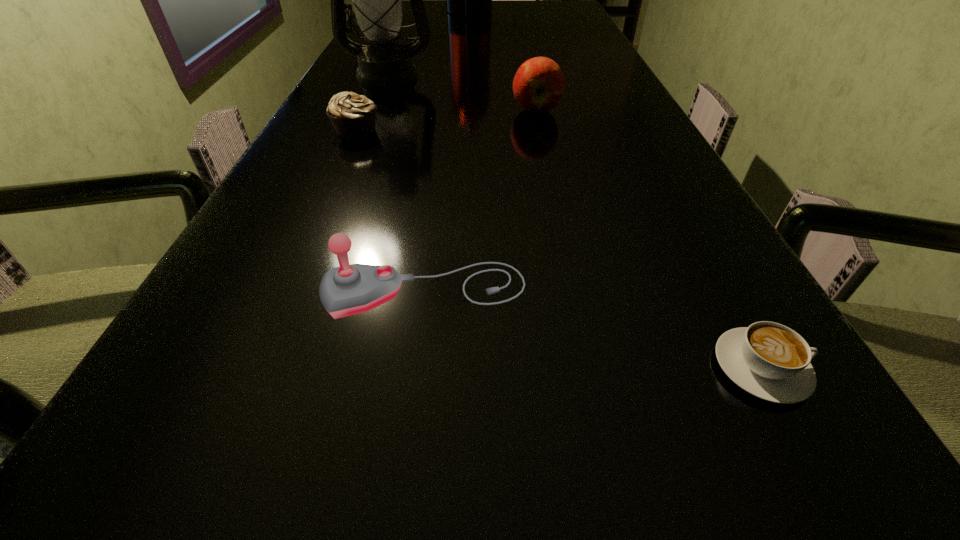
Locate an element on the screen. vacant space at the near edge is located at coordinates pos(685,490).

This screenshot has width=960, height=540. I want to click on free location at the left edge of the desktop, so click(x=315, y=234).

This screenshot has height=540, width=960. In the image, there is a desktop. In order to click on free region at the right edge in this screenshot , I will do `click(575, 68)`.

I want to click on blank space at the near left corner of the desktop, so (147, 520).

Where is `free space between the fifth farthest object and the second tallest object`? The height and width of the screenshot is (540, 960). free space between the fifth farthest object and the second tallest object is located at coordinates (406, 183).

Locate an element on the screen. This screenshot has width=960, height=540. free space that is in between the farthest object and the shortest object is located at coordinates tap(615, 191).

Where is `vacant region between the second nearest object and the muffin`? The height and width of the screenshot is (540, 960). vacant region between the second nearest object and the muffin is located at coordinates (391, 211).

You are a GUI agent. You are given a task and a screenshot of the screen. Output one action in this format:
    pyautogui.click(x=<x>, y=<y>)
    Task: Click on the free spot between the apple and the fire extinguisher
    
    Given the screenshot: What is the action you would take?
    pyautogui.click(x=502, y=62)

Identify the location of vacant area that lies between the joystick and the rightmost object. (593, 329).

Where is `free space between the fifth object from left to right and the fire extinguisher`? The height and width of the screenshot is (540, 960). free space between the fifth object from left to right and the fire extinguisher is located at coordinates (502, 62).